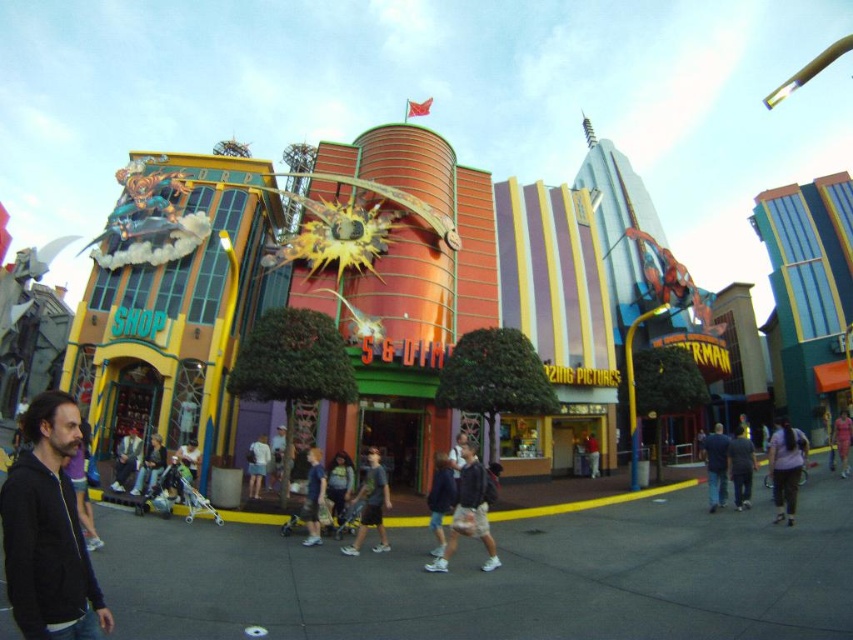
Between dark gray t-shirt at center and denim jacket at center, which one is positioned lower?

denim jacket at center is below.

Which is behind, point (375, 492) or point (337, 476)?

The point (337, 476) is behind.

Is point (361, 484) closer to viewer compared to point (344, 476)?

No, (361, 484) is further to viewer.

Find the location of `dark gray t-shirt at center`. dark gray t-shirt at center is located at coordinates (370, 506).

Consider the image. Is the position of purple fabric shirt at lower right more distant than that of dark blue jeans at lower right?

No, purple fabric shirt at lower right is closer to the viewer.

Find the location of a particular element. The image size is (853, 640). purple fabric shirt at lower right is located at coordinates (785, 468).

Who is more forward, [769,461] or [711,504]?

Point [711,504] is in front.

The height and width of the screenshot is (640, 853). I want to click on purple fabric shirt at lower right, so click(785, 468).

Is dark gray hoodie at center shorter than denim jacket at center?

No.

Between dark gray hoodie at center and denim jacket at center, which one has less height?

With less height is denim jacket at center.

Who is more forward, [489,566] or [344,499]?

Point [489,566] is more forward.

Identify the location of dark gray hoodie at center. (469, 513).